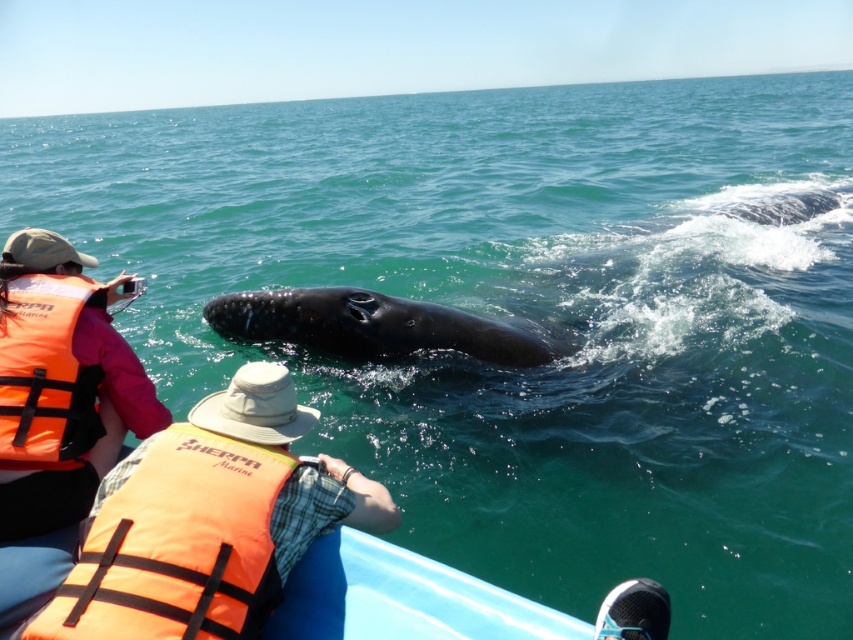
Measure the distance between point (387,340) and camera.

Point (387,340) and camera are 13.58 feet apart.

This screenshot has width=853, height=640. Describe the element at coordinates (370, 324) in the screenshot. I see `black smooth humpback whale at center` at that location.

Locate an element on the screen. The image size is (853, 640). black smooth humpback whale at center is located at coordinates (370, 324).

Does orange fabric life jacket at lower left have a smaller size compared to orange life vest at left?

Indeed, orange fabric life jacket at lower left has a smaller size compared to orange life vest at left.

Who is positioned more to the right, orange fabric life jacket at lower left or orange life vest at left?

Positioned to the right is orange fabric life jacket at lower left.

Between point (138, 564) and point (93, 401), which one is positioned behind?

The point (93, 401) is more distant.

Where is `orange fabric life jacket at lower left`? Image resolution: width=853 pixels, height=640 pixels. orange fabric life jacket at lower left is located at coordinates tap(177, 547).

Who is positioned more to the right, orange fabric life jacket at lower left or black smooth humpback whale at center?

black smooth humpback whale at center

From the picture: Who is shorter, orange fabric life jacket at lower left or black smooth humpback whale at center?

black smooth humpback whale at center

Which is in front, point (172, 582) or point (325, 330)?

Point (172, 582) is in front.

Find the location of `orange fabric life jacket at lower left`. orange fabric life jacket at lower left is located at coordinates (177, 547).